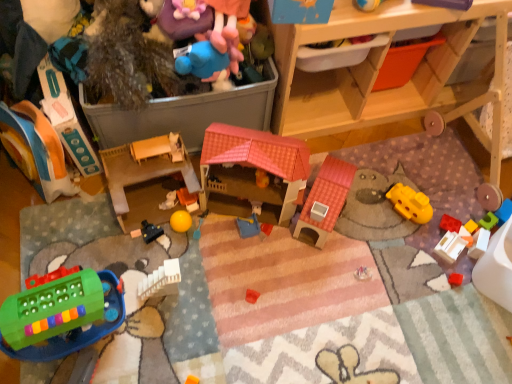
Locate an element on the screen. This screenshot has width=512, height=384. vacant area that is in front of translucent orange cube at center, which ranks as the eleventh toy in left-to-right order is located at coordinates (462, 291).